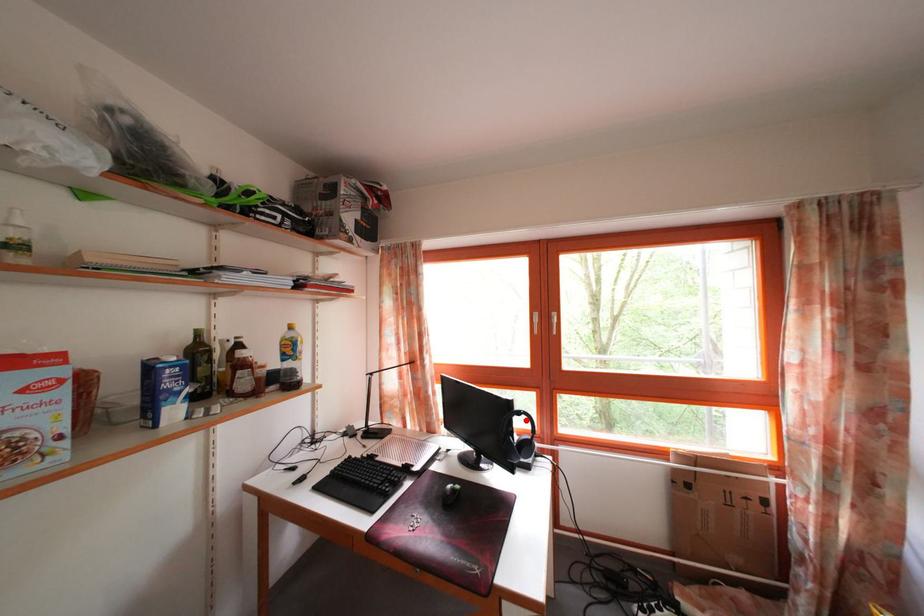
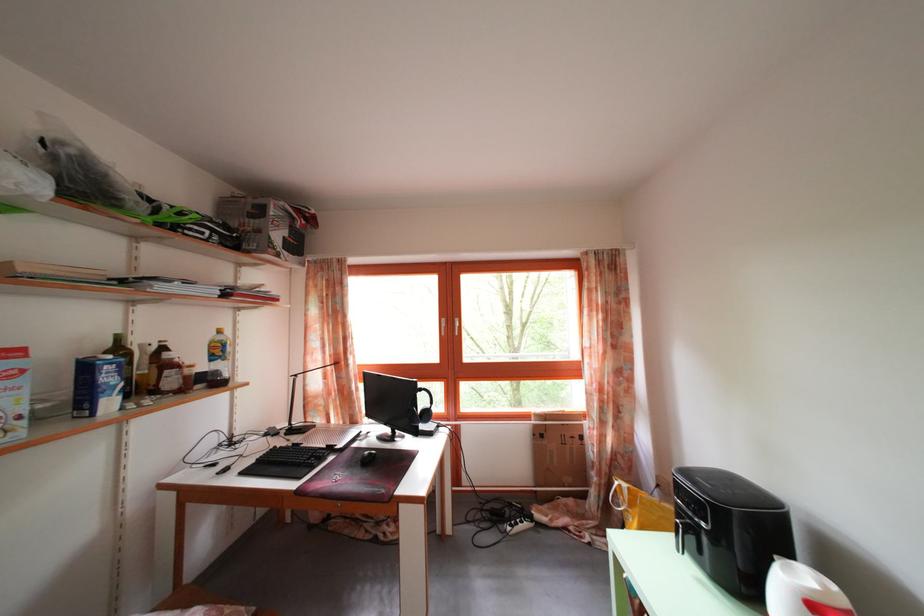
Question: I am providing you with two images of the same scene from different viewpoints. A red point is marked on the first image. At the location where the point appears in image 1, is it still visible in image 2?

Choices:
 (A) Yes
 (B) No

Answer: (A)